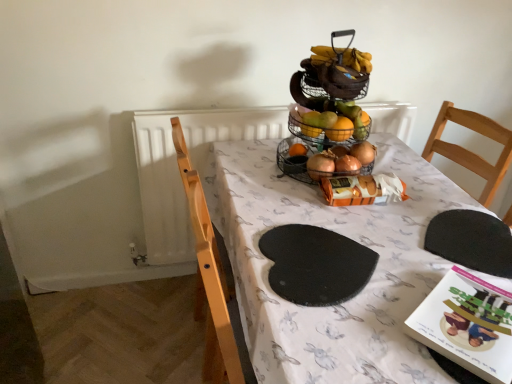
Find the location of a particular element. Image resolution: width=512 pixels, height=384 pixels. vacant space that is to the left of wire mesh basket at center is located at coordinates (272, 167).